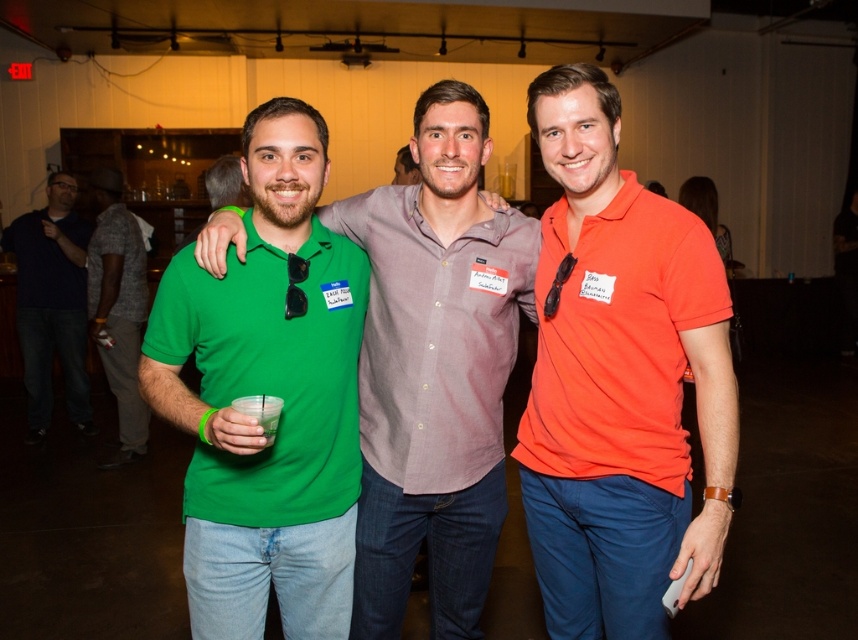
Question: Does matte green polo shirt at left appear over green matte polo shirt at left?

Choices:
 (A) no
 (B) yes

Answer: (A)

Question: Does green matte polo shirt at left come in front of matte black shirt at left?

Choices:
 (A) yes
 (B) no

Answer: (A)

Question: Which of these objects is positioned closest to the matte black shirt at left?

Choices:
 (A) translucent plastic cup at center
 (B) orange matte shirt at center
 (C) matte green polo shirt at left

Answer: (C)

Question: Which point is closer to the camera?

Choices:
 (A) translucent plastic cup at center
 (B) gray cotton shirt at center
 (C) matte black shirt at left
 (D) green matte polo shirt at left

Answer: (A)

Question: Does matte green polo shirt at left have a smaller size compared to translucent plastic cup at center?

Choices:
 (A) no
 (B) yes

Answer: (A)

Question: Which object appears farthest from the camera in this image?

Choices:
 (A) matte black shirt at left
 (B) gray cotton shirt at center
 (C) green matte polo shirt at left

Answer: (A)